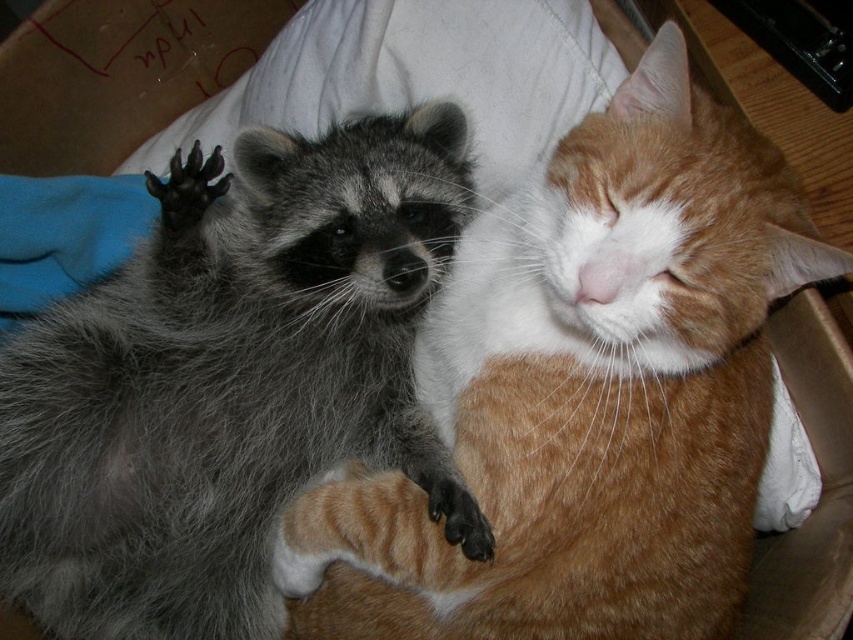
You are a photographer trying to capture a portrait of the orange tabby cat at center and the gray fur raccoon at upper left. Since you want both subjects to be in focus, you need to know which one is taller. Can you determine which animal is taller?

The orange tabby cat at center is taller than the gray fur raccoon at upper left, so you should adjust your camera settings to focus on the taller animal first.

You are a photographer trying to capture a closeup of the gray fur raccoon at upper left without disturbing the orange tabby cat at center. Since the cat is on the right side of the raccoon, which direction should you approach from to avoid waking the cat?

The orange tabby cat at center is positioned on the right side of the gray fur raccoon at upper left. To avoid waking the cat, you should approach from the left side of the raccoon, opposite the cat.

You are a photographer trying to capture both the orange tabby cat at center and the gray fur raccoon at upper left in a single frame. Given their sizes, which animal should you focus on to ensure both fit comfortably in the photo?

The orange tabby cat at center is wider than the gray fur raccoon at upper left, so focusing on the cat while adjusting the camera angle to include the raccoon would ensure both fit comfortably in the photo.